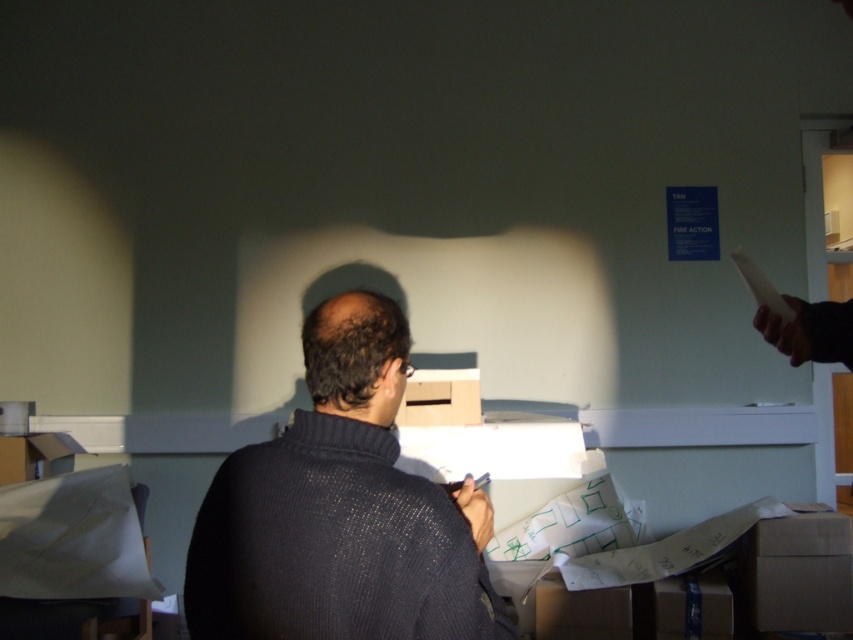
Is dark knit sweater at center above cardboard box at lower right?

Yes.

Can you confirm if dark knit sweater at center is thinner than cardboard box at lower right?

In fact, dark knit sweater at center might be wider than cardboard box at lower right.

Does point (267, 616) come in front of point (785, 524)?

Yes, it is.

This screenshot has height=640, width=853. I want to click on dark knit sweater at center, so click(x=340, y=512).

Who is lower down, cardboard box at lower right or matte cardboard box at center?

Positioned lower is cardboard box at lower right.

Looking at this image, is cardboard box at lower right bigger than matte cardboard box at center?

Indeed, cardboard box at lower right has a larger size compared to matte cardboard box at center.

Does point (752, 545) lie behind point (408, 408)?

Yes.

In order to click on cardboard box at lower right in this screenshot , I will do `click(796, 573)`.

From the picture: Does dark knit sweater at center have a smaller size compared to matte cardboard box at center?

No, dark knit sweater at center is not smaller than matte cardboard box at center.

Is dark knit sweater at center below matte cardboard box at center?

Incorrect, dark knit sweater at center is not positioned below matte cardboard box at center.

Which is behind, point (381, 616) or point (434, 417)?

Positioned behind is point (434, 417).

Find the location of a particular element. Image resolution: width=853 pixels, height=640 pixels. dark knit sweater at center is located at coordinates (340, 512).